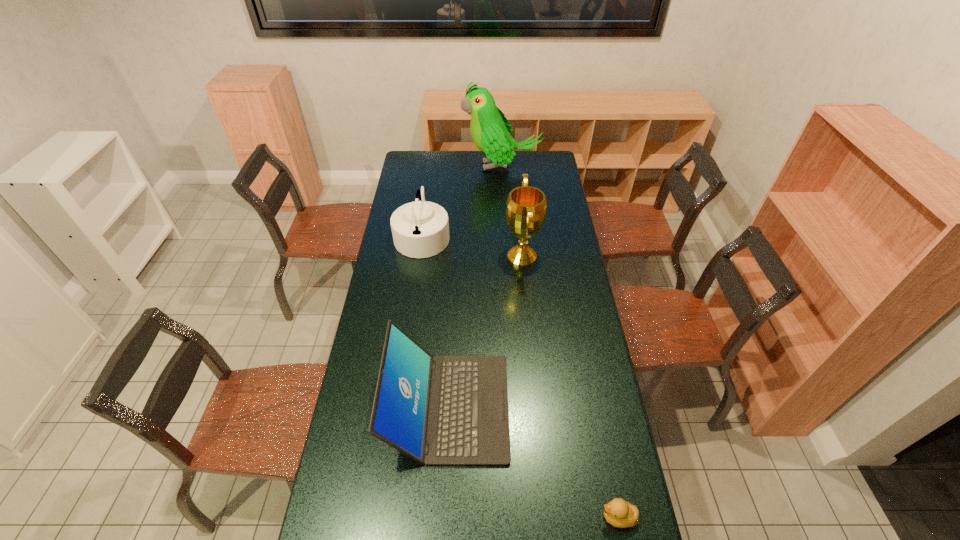
Identify the location of free space between the second tallest object and the second nearest object. (486, 332).

This screenshot has height=540, width=960. I want to click on unoccupied position between the laptop computer and the kettle, so click(x=436, y=321).

The image size is (960, 540). In order to click on free spot between the kettle and the award in this screenshot , I will do `click(472, 246)`.

Locate an element on the screen. blank region between the farthest object and the kettle is located at coordinates (462, 201).

This screenshot has width=960, height=540. I want to click on free area in between the farthest object and the kettle, so click(462, 201).

Identify the location of free space between the fourth farthest object and the kettle. This screenshot has height=540, width=960. (436, 321).

Locate an element on the screen. The width and height of the screenshot is (960, 540). object that is the second closest to the parakeet is located at coordinates (526, 206).

Select which object appears as the fourth closest to the kettle. Please provide its 2D coordinates. Your answer should be formatted as a tuple, i.e. [(x, y)], where the tuple contains the x and y coordinates of a point satisfying the conditions above.

[(620, 513)]